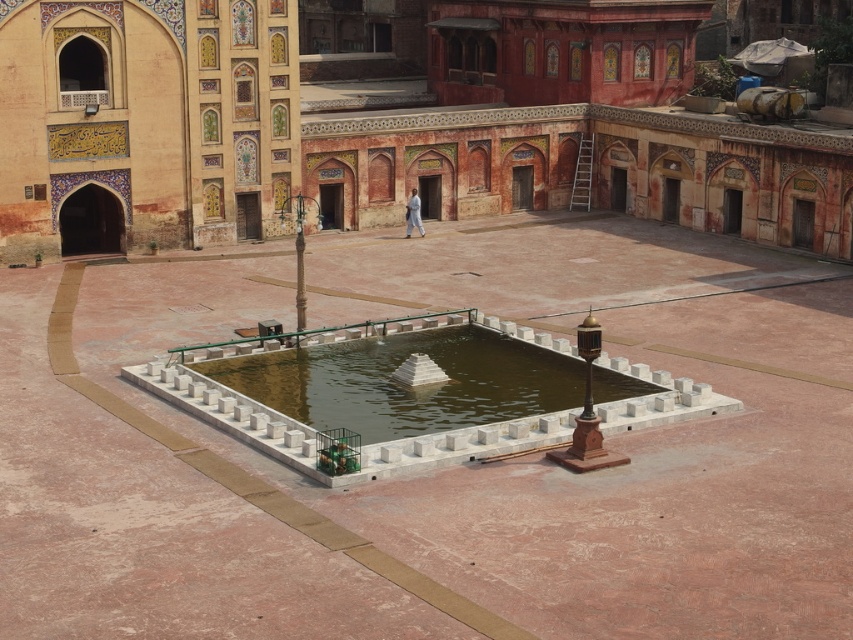
Can you confirm if smooth stone fountain at center is positioned above clear water at center?

Yes.

Is point (409, 132) positioned before point (300, 355)?

That is False.

In order to click on smooth stone fountain at center in this screenshot , I will do `click(392, 120)`.

How far apart are white marble fountain at center and smooth stone fountain at center?

white marble fountain at center is 48.95 feet from smooth stone fountain at center.

Who is lower down, white marble fountain at center or smooth stone fountain at center?

Positioned lower is white marble fountain at center.

Does point (700, 280) come behind point (695, 28)?

No, it is not.

Where is `white marble fountain at center`? The height and width of the screenshot is (640, 853). white marble fountain at center is located at coordinates (421, 483).

Is white marble fountain at center to the left of clear water at center from the viewer's perspective?

In fact, white marble fountain at center is to the right of clear water at center.

Is point (814, 513) farther from camera compared to point (511, 342)?

No, (814, 513) is closer to viewer.

This screenshot has width=853, height=640. Find the location of `white marble fountain at center`. white marble fountain at center is located at coordinates (421, 483).